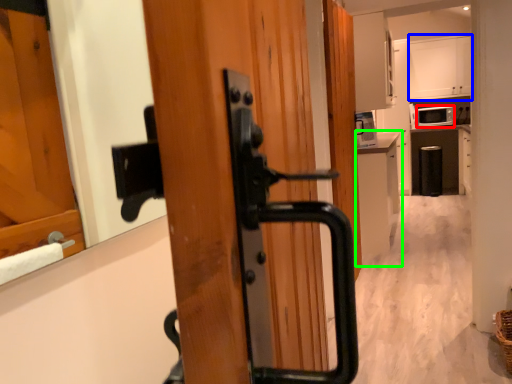
Question: Which object is positioned closest to appliance (highlighted by a red box)? Select from cabinetry (highlighted by a blue box) and cabinetry (highlighted by a green box).

Choices:
 (A) cabinetry
 (B) cabinetry

Answer: (A)